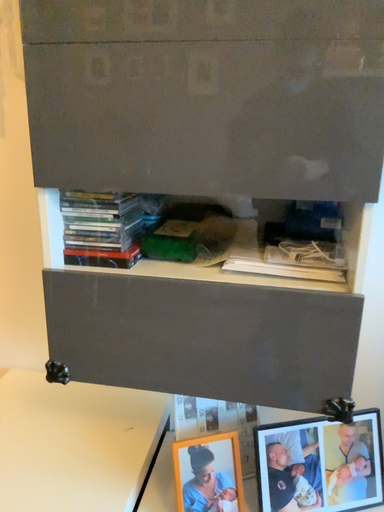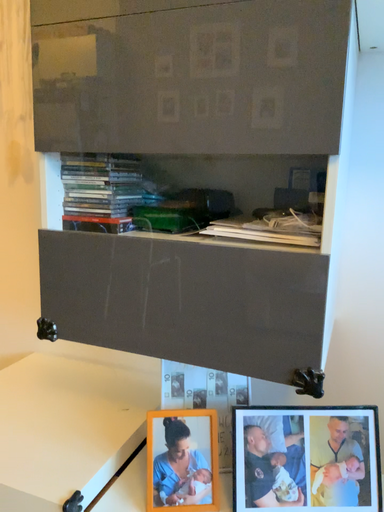
Question: How did the camera likely rotate when shooting the video?

Choices:
 (A) rotated upward
 (B) rotated downward

Answer: (A)